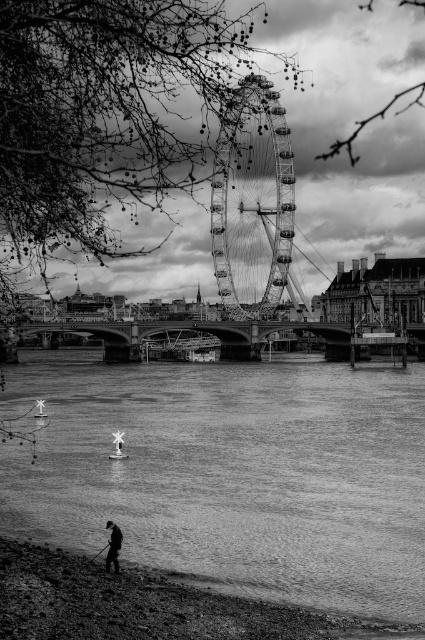
You are standing on the riverbank and see the metallic ferris wheel at center and the dark gray fabric person at lower center. Which object appears wider in the image?

The metallic ferris wheel at center appears wider than the dark gray fabric person at lower center because its width surpasses the person.

You are standing on the riverbank and see two points marked on the left side of the river. The first point is at coordinates point (25, 497) and the second is at point (113, 557). From your perspective, which point is closer to you?

Point (113, 557) is closer to you because point (25, 497) is behind it.